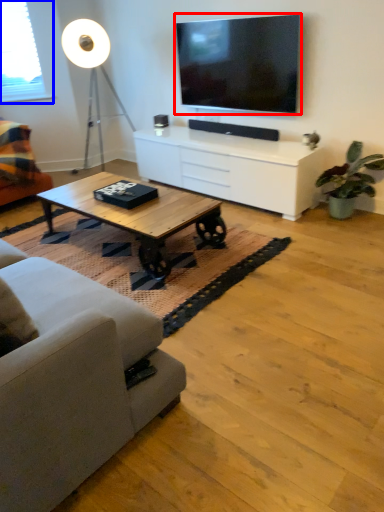
Question: Among these objects, which one is farthest to the camera, television (highlighted by a red box) or window screen (highlighted by a blue box)?

Choices:
 (A) television
 (B) window screen

Answer: (B)